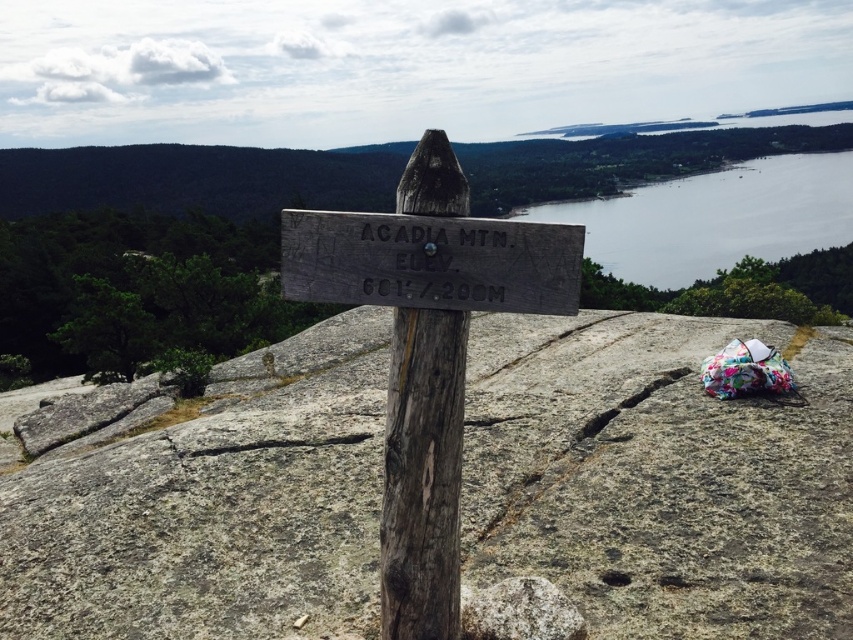
You are a hiker who wants to take a photo of the weathered wood sign at center and the gray rough rock at center. Which object should you focus on first if you want to capture both in a single frame without moving your camera?

The gray rough rock at center is shorter than the weathered wood sign at center, so you should focus on the weathered wood sign at center first to ensure both are in the frame.

Looking at this image, you are standing at the overlook and want to take a photo of the white textured rock at center and the gray water at upper right. Which object should you pan your camera to the right to capture first?

You should pan your camera to the right to capture the gray water at upper right first because it is positioned to the right of the white textured rock at center.

You are a hiker standing at the overlook on Acadia Mountain. You see the gray rough rock at center and the weathered wood sign at center. Which object is closer to your feet?

The gray rough rock at center is closer to your feet because it is positioned below the weathered wood sign at center, meaning it is lower in elevation.